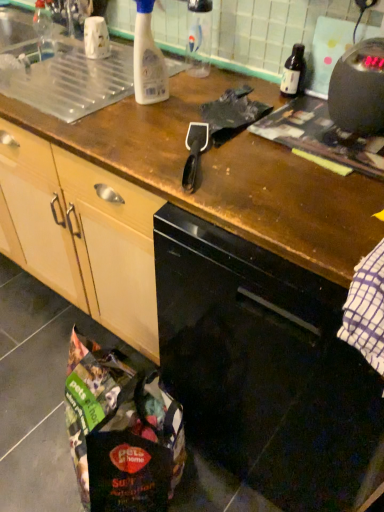
This screenshot has width=384, height=512. I want to click on vacant space to the left of black plastic spatula at center, so (x=132, y=150).